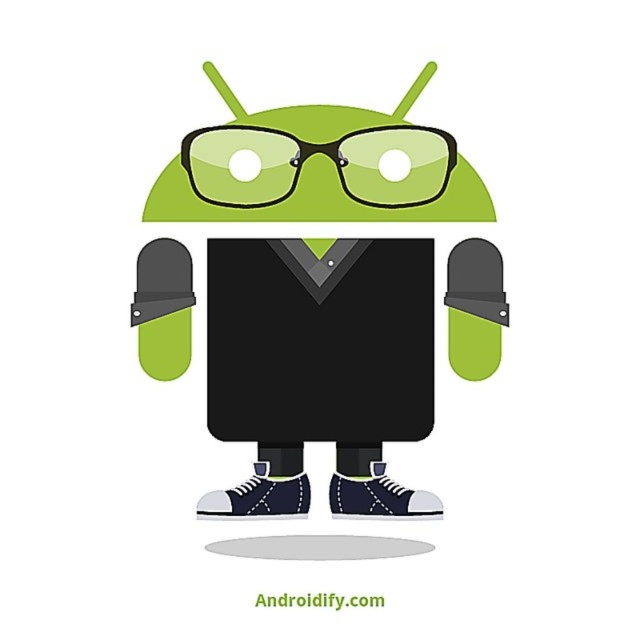
Between matte black android at center and green matte android head at upper center, which one has less height?

Standing shorter between the two is green matte android head at upper center.

Which is behind, point (305, 266) or point (458, 188)?

Positioned behind is point (305, 266).

Identify the location of matte black android at center. The image size is (640, 640). (320, 368).